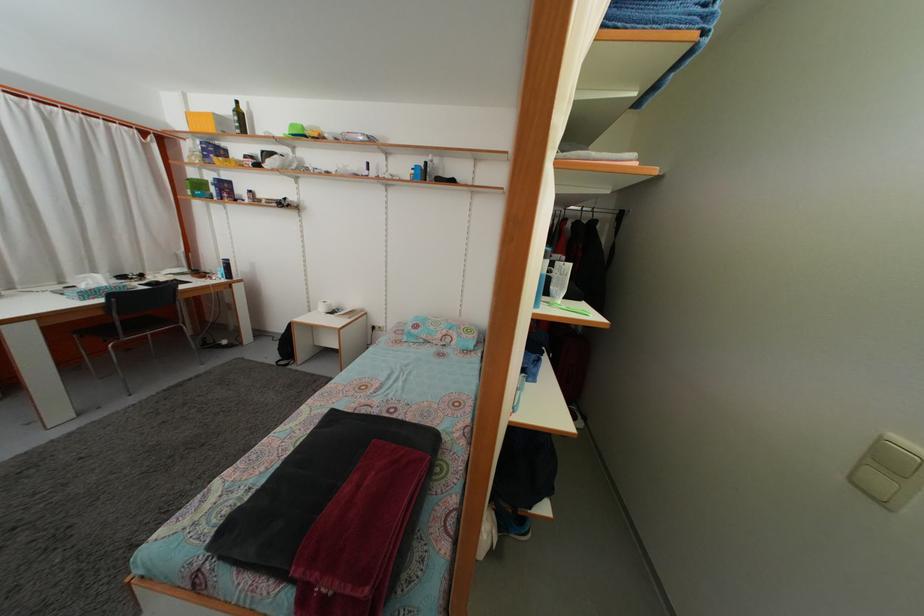
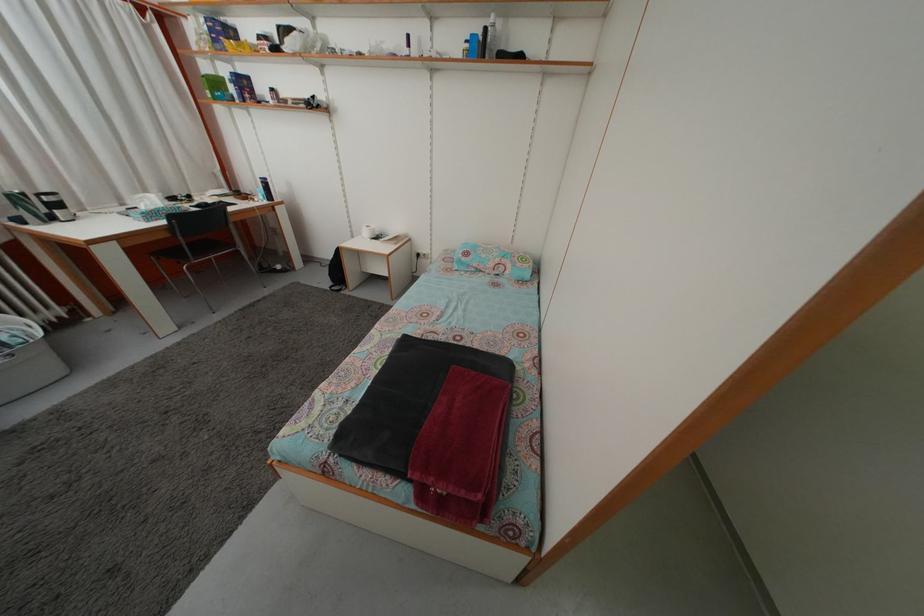
Where in the second image is the point corresponding to point (432, 171) from the first image?

(492, 38)